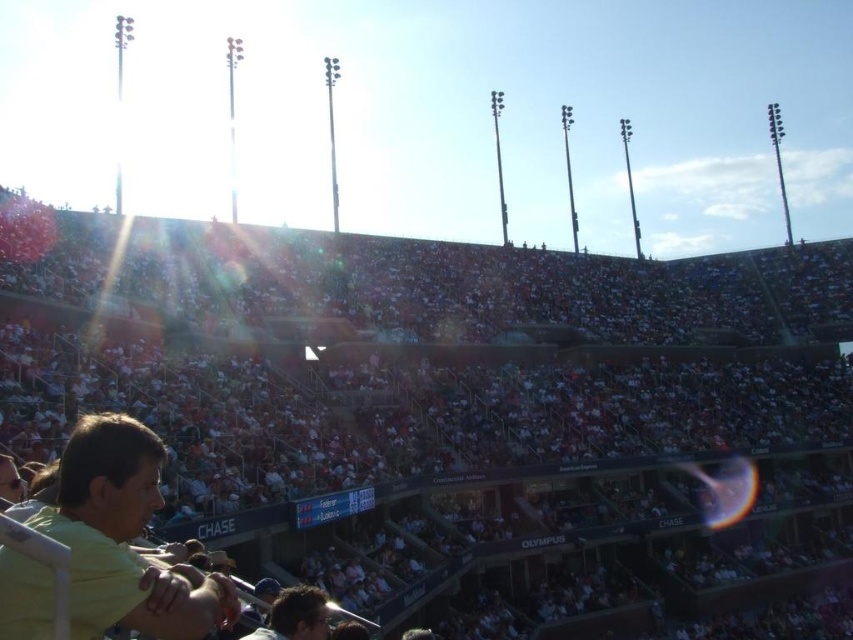
Is yellow matte shirt at lower left shorter than dark brown hair at lower center?

No.

Between yellow matte shirt at lower left and dark brown hair at lower center, which one appears on the left side from the viewer's perspective?

Positioned to the left is yellow matte shirt at lower left.

Who is more forward, (3, 593) or (281, 637)?

Point (3, 593)

Identify the location of yellow matte shirt at lower left. This screenshot has width=853, height=640. 122,536.

Is point (373, 582) positioned behind point (305, 588)?

Yes.

Between point (351, 506) and point (293, 609), which one is positioned behind?

Point (351, 506)

Locate an element on the screen. The height and width of the screenshot is (640, 853). white fabric crowd at center is located at coordinates (450, 410).

Is white fabric crowd at center thinner than yellow matte shirt at lower left?

Incorrect, white fabric crowd at center's width is not less than yellow matte shirt at lower left's.

Between white fabric crowd at center and yellow matte shirt at lower left, which one appears on the right side from the viewer's perspective?

white fabric crowd at center is more to the right.

Is point (42, 365) closer to camera compared to point (3, 625)?

No, it is not.

In order to click on white fabric crowd at center in this screenshot , I will do `click(450, 410)`.